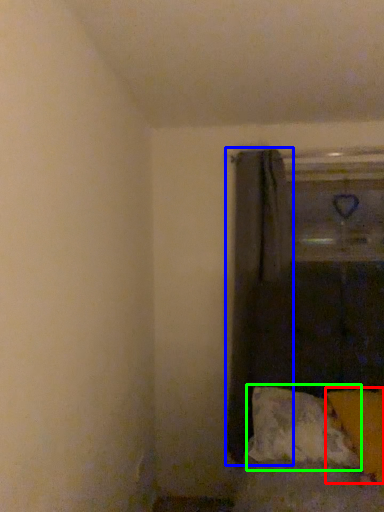
Question: Which object is positioned closest to pillow (highlighted by a red box)? Select from curtain (highlighted by a blue box) and pillow (highlighted by a green box).

Choices:
 (A) curtain
 (B) pillow

Answer: (B)